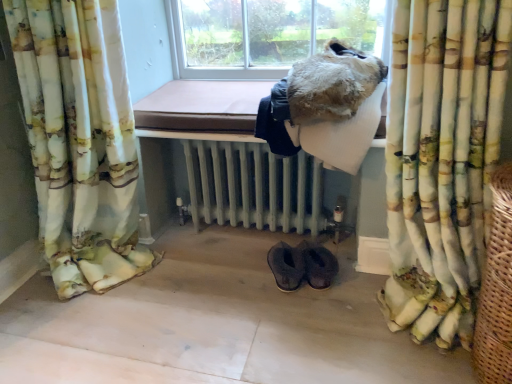
The image size is (512, 384). I want to click on free space between printed fabric curtain at right, acting as the 2th curtain starting from the left, and brown suede slippers at lower center, so click(x=327, y=302).